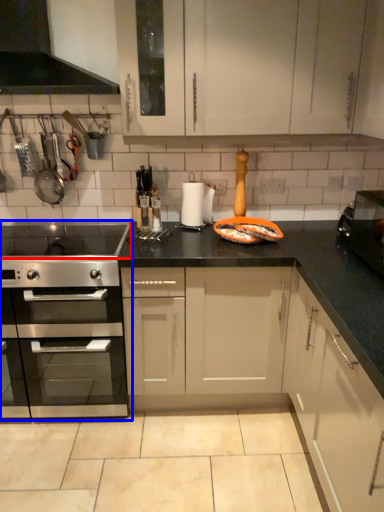
Question: Which point is further to the camera, gas stove (highlighted by a red box) or kitchen appliance (highlighted by a blue box)?

Choices:
 (A) gas stove
 (B) kitchen appliance

Answer: (B)